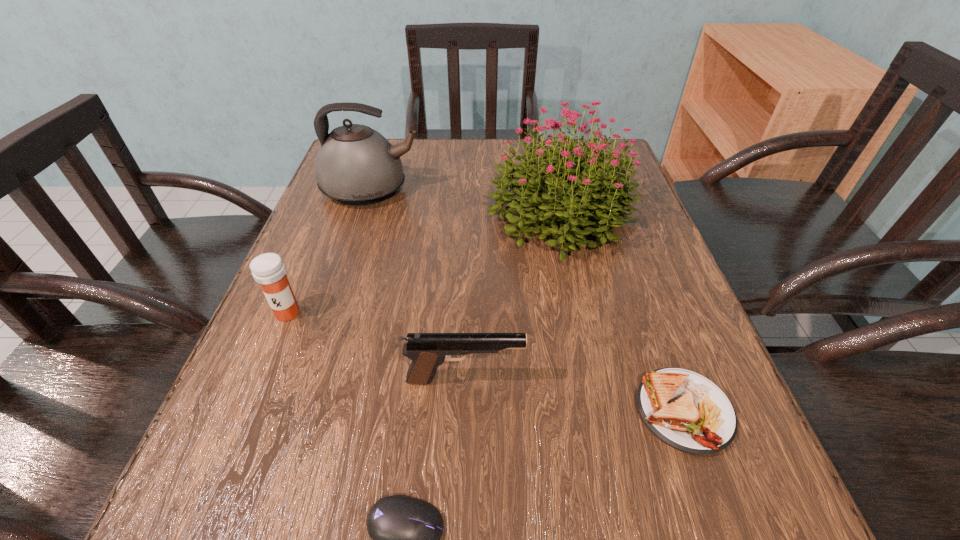
Identify the location of bouquet located at the far edge. (547, 181).

Image resolution: width=960 pixels, height=540 pixels. Find the location of `kettle located at the far edge`. kettle located at the far edge is located at coordinates (356, 165).

At what (x,y) coordinates should I click in order to perform the action: click on kettle present at the left edge. Please return your answer as a coordinate pair (x, y). The image size is (960, 540). Looking at the image, I should click on (356, 165).

Where is `medicine that is at the left edge`? The height and width of the screenshot is (540, 960). medicine that is at the left edge is located at coordinates (268, 269).

Identify the location of bouquet situated at the right edge. (547, 181).

Where is `sandwich at the right edge`? The image size is (960, 540). sandwich at the right edge is located at coordinates (687, 411).

The image size is (960, 540). What are the coordinates of `object that is at the far left corner` in the screenshot? It's located at (356, 165).

You are a GUI agent. You are given a task and a screenshot of the screen. Output one action in this format:
    pyautogui.click(x=<x>, y=<y>)
    Task: Click on the object that is positioned at the far right corner
    The width and height of the screenshot is (960, 540).
    Given the screenshot: What is the action you would take?
    pyautogui.click(x=547, y=181)

Find the location of a particular element. Image resolution: width=960 pixels, height=540 pixels. blank space at the far edge of the desktop is located at coordinates (470, 170).

Find the location of a particular element. This screenshot has width=960, height=540. free spot at the near edge of the desktop is located at coordinates (325, 527).